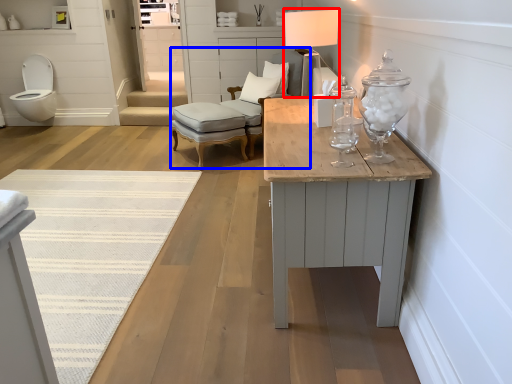
Question: Which object is closer to the camera taking this photo, table lamp (highlighted by a red box) or armchair (highlighted by a blue box)?

Choices:
 (A) table lamp
 (B) armchair

Answer: (A)